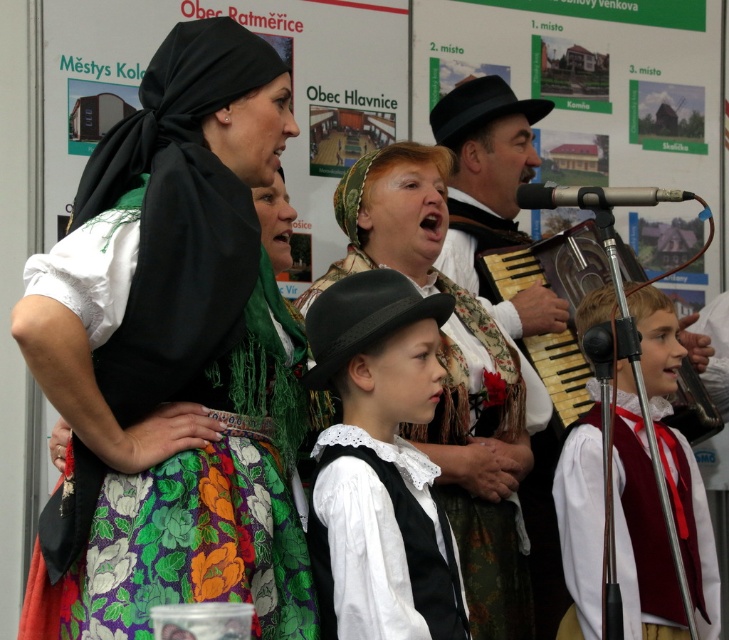
Question: Is black felt hat at center thinner than silver metallic microphone at upper right?

Choices:
 (A) yes
 (B) no

Answer: (A)

Question: Among these objects, which one is nearest to the camera?

Choices:
 (A) white satin vest at center
 (B) white lace blouse at center

Answer: (A)

Question: Which of these objects is positioned farthest from the wooden accordion at center?

Choices:
 (A) silver metallic microphone at upper right
 (B) black felt hat at center
 (C) floral fabric dress at center

Answer: (C)

Question: Which of the following is the farthest from the observer?

Choices:
 (A) (550, 189)
 (B) (550, 576)
 (C) (695, 625)

Answer: (B)

Question: Does floral fabric dress at center lie behind black felt hat at center?

Choices:
 (A) yes
 (B) no

Answer: (B)

Question: Is white lace blouse at center above wooden accordion at center?

Choices:
 (A) no
 (B) yes

Answer: (A)